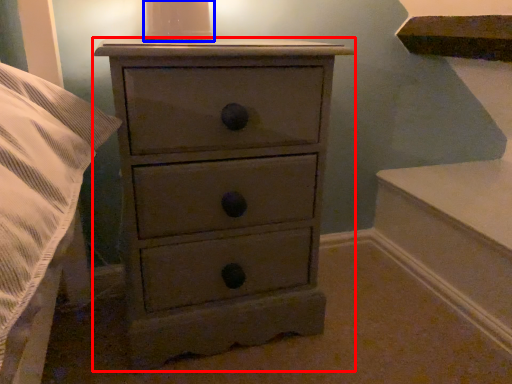
Question: Which point is further to the camera, chest of drawers (highlighted by a red box) or candle holder (highlighted by a blue box)?

Choices:
 (A) chest of drawers
 (B) candle holder

Answer: (B)